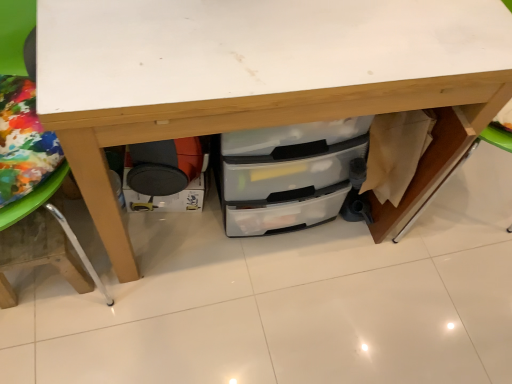
The width and height of the screenshot is (512, 384). Identify the location of empty space that is ontop of transparent plastic drawers at center. (318, 28).